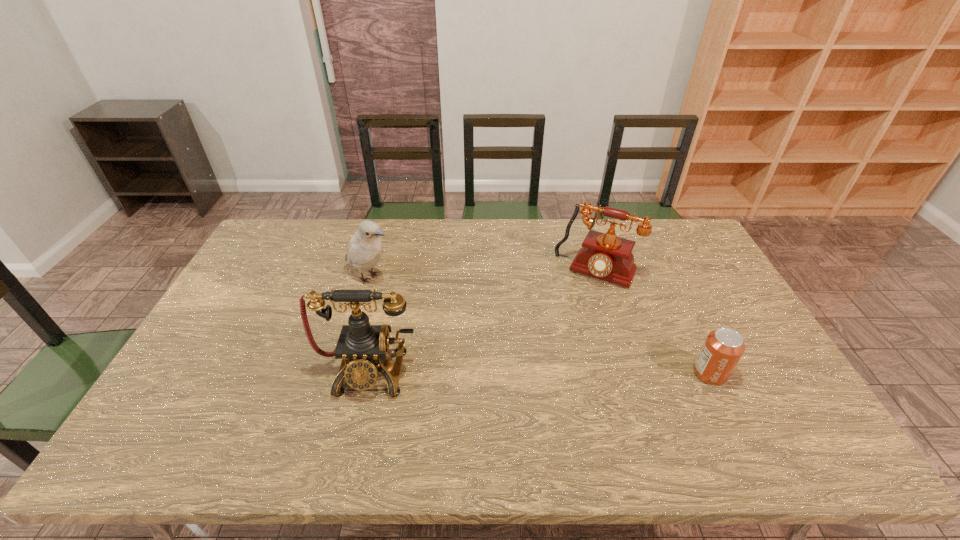
I want to click on the left telephone, so click(362, 347).

The width and height of the screenshot is (960, 540). Identify the location of can. (723, 348).

Image resolution: width=960 pixels, height=540 pixels. In order to click on the rightmost object in this screenshot , I will do `click(723, 348)`.

Where is `the farther telephone`? This screenshot has width=960, height=540. the farther telephone is located at coordinates (607, 257).

Find the location of `the right telephone`. the right telephone is located at coordinates (607, 257).

Identify the location of bird. (365, 249).

Locate an element on the screen. The width and height of the screenshot is (960, 540). vacant space located on the left of the shortest object is located at coordinates (629, 374).

At what (x,y) coordinates should I click in order to perform the action: click on vacant space located on the dial of the farther telephone. Please return your answer as a coordinate pair (x, y). The image size is (960, 540). Looking at the image, I should click on (553, 349).

In order to click on blank space located on the dial of the farther telephone in this screenshot , I will do `click(564, 327)`.

Locate an element on the screen. blank space located on the dial of the farther telephone is located at coordinates (541, 372).